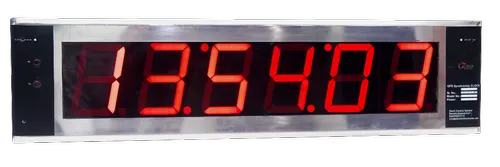
Locate an element on the screen. The height and width of the screenshot is (167, 500). backdrop is located at coordinates (90, 66), (138, 90), (200, 89), (260, 76), (291, 58), (350, 79), (387, 89).